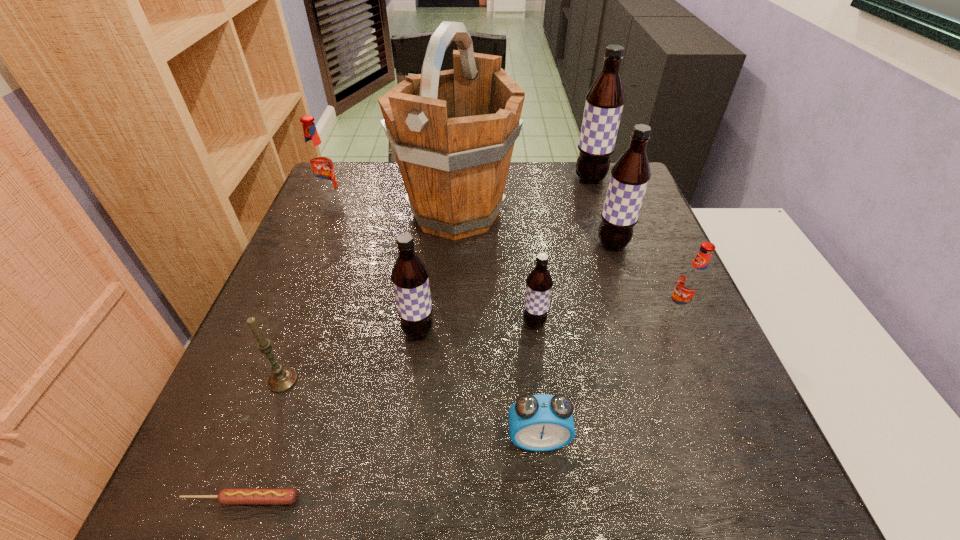
The image size is (960, 540). I want to click on free space located on the left of the second tallest root beer, so click(439, 244).

Locate an element on the screen. The height and width of the screenshot is (540, 960). free region located 0.240m on the front of the left red root beer is located at coordinates (300, 270).

The width and height of the screenshot is (960, 540). What are the coordinates of `free region located on the back of the fifth root beer from right to left` in the screenshot? It's located at (431, 231).

Where is `vacant position located 0.370m on the back of the right red root beer`? This screenshot has width=960, height=540. vacant position located 0.370m on the back of the right red root beer is located at coordinates (632, 203).

Find the location of a particular element. The image size is (960, 540). blank space located on the right of the third root beer from left to right is located at coordinates (591, 323).

At what (x,y) coordinates should I click in order to perform the action: click on free space located on the back of the third nearest object. Please return your answer as a coordinate pair (x, y). Looking at the image, I should click on (324, 269).

Find the location of a particular element. vacant region located on the face of the second shortest object is located at coordinates (543, 492).

At what (x,y) coordinates should I click in order to perform the action: click on vacant area situated 0.270m on the right of the shortest object. Please return your answer as a coordinate pair (x, y). Looking at the image, I should click on (482, 500).

In order to click on bucket located in the far edge section of the desktop in this screenshot , I will do `click(453, 132)`.

The image size is (960, 540). What are the coordinates of `alarm clock located in the near edge section of the desktop` in the screenshot? It's located at (542, 422).